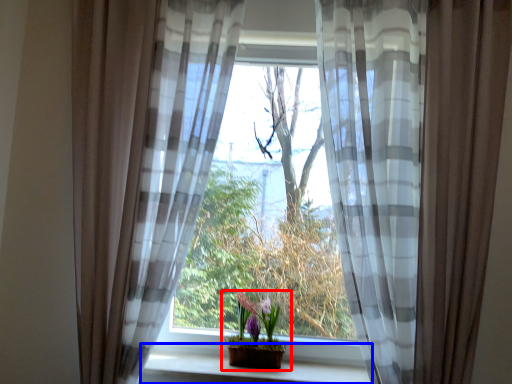
Question: Which point is further to the camera, houseplant (highlighted by a red box) or window sill (highlighted by a blue box)?

Choices:
 (A) houseplant
 (B) window sill

Answer: (A)